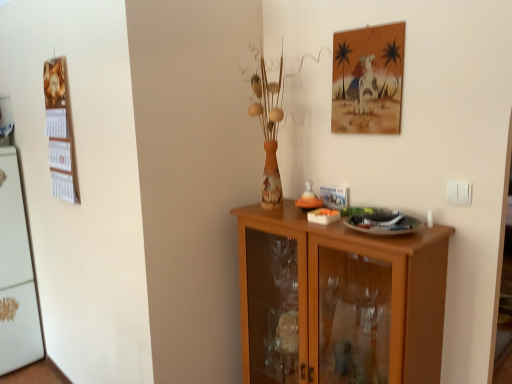
Question: Is matte paper picture frame at upper right facing away from wooden calendar at left?

Choices:
 (A) yes
 (B) no

Answer: (B)

Question: Is matte paper picture frame at upper right not within wooden calendar at left?

Choices:
 (A) yes
 (B) no

Answer: (A)

Question: Considering the relative sizes of matte paper picture frame at upper right and wooden calendar at left in the image provided, is matte paper picture frame at upper right thinner than wooden calendar at left?

Choices:
 (A) no
 (B) yes

Answer: (B)

Question: From a real-world perspective, does matte paper picture frame at upper right sit lower than wooden calendar at left?

Choices:
 (A) no
 (B) yes

Answer: (A)

Question: Is matte paper picture frame at upper right shorter than wooden calendar at left?

Choices:
 (A) yes
 (B) no

Answer: (A)

Question: Is point (459, 200) positioned closer to the camera than point (373, 28)?

Choices:
 (A) closer
 (B) farther

Answer: (A)

Question: From the image's perspective, is white plastic switch at right positioned above or below matte paper picture frame at upper right?

Choices:
 (A) above
 (B) below

Answer: (B)

Question: Is white plastic switch at right in front of or behind matte paper picture frame at upper right in the image?

Choices:
 (A) behind
 (B) front

Answer: (B)

Question: Is white plastic switch at right taller or shorter than matte paper picture frame at upper right?

Choices:
 (A) short
 (B) tall

Answer: (A)

Question: Would you say matte paper picture frame at upper right is inside or outside wooden calendar at left?

Choices:
 (A) inside
 (B) outside

Answer: (B)

Question: In the image, is matte paper picture frame at upper right positioned in front of or behind wooden calendar at left?

Choices:
 (A) front
 (B) behind

Answer: (A)

Question: From the image's perspective, is matte paper picture frame at upper right positioned above or below wooden calendar at left?

Choices:
 (A) above
 (B) below

Answer: (A)

Question: Looking at the image, does matte paper picture frame at upper right seem bigger or smaller compared to wooden calendar at left?

Choices:
 (A) small
 (B) big

Answer: (A)

Question: Is light brown wood cabinet at center taller or shorter than matte paper picture frame at upper right?

Choices:
 (A) tall
 (B) short

Answer: (A)

Question: In terms of size, does light brown wood cabinet at center appear bigger or smaller than matte paper picture frame at upper right?

Choices:
 (A) big
 (B) small

Answer: (A)